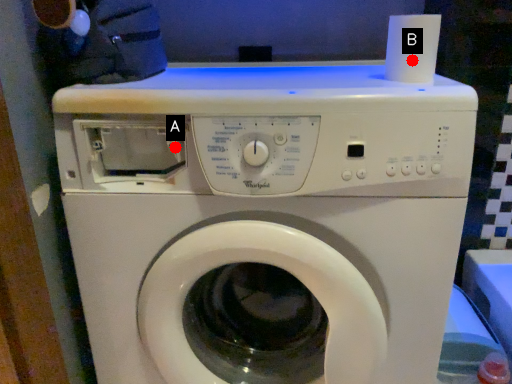
Question: Two points are circled on the image, labeled by A and B beside each circle. Which of the following is the closest to the observer?

Choices:
 (A) A is closer
 (B) B is closer

Answer: (B)